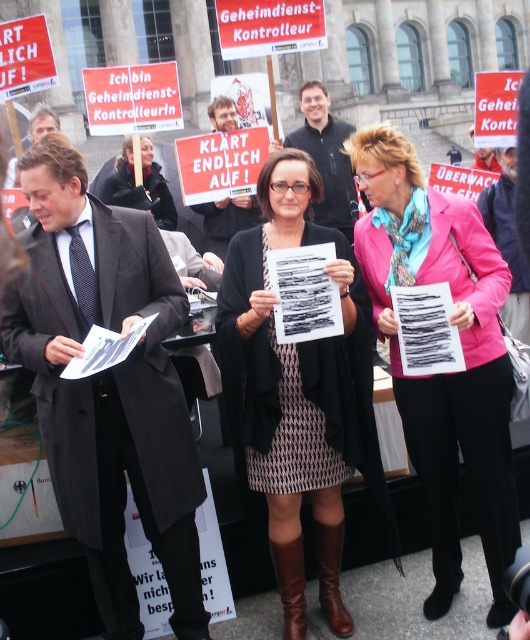
Is black fabric shirt at center shorter than matte black coat at center?

Incorrect, black fabric shirt at center's height does not fall short of matte black coat at center's.

Which of these two, black fabric shirt at center or matte black coat at center, stands taller?

With more height is black fabric shirt at center.

Find the location of a particular element. black fabric shirt at center is located at coordinates (326, 157).

Measure the distance between point (154,237) and camera.

Point (154,237) and camera are 37.74 meters apart.

Who is more distant from viewer, (149, 364) or (114, 188)?

Positioned behind is point (114, 188).

What do you see at coordinates (108, 387) in the screenshot? I see `dark gray suit at left` at bounding box center [108, 387].

Where is `dark gray suit at left`? This screenshot has width=530, height=640. dark gray suit at left is located at coordinates [108, 387].

Is matte black coat at center thinner than matte black sign at center?

In fact, matte black coat at center might be wider than matte black sign at center.

Does matte black coat at center have a greater height compared to matte black sign at center?

No.

This screenshot has height=640, width=530. Describe the element at coordinates (137, 186) in the screenshot. I see `matte black coat at center` at that location.

You are a GUI agent. You are given a task and a screenshot of the screen. Output one action in this format:
    pyautogui.click(x=<x>, y=<y>)
    Task: Click on the matte black coat at center
    
    Given the screenshot: What is the action you would take?
    pyautogui.click(x=137, y=186)